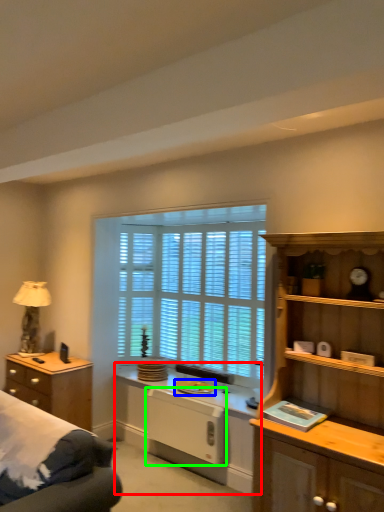
Question: Which is nearer to the computer desk (highlighted by a red box)? appliance (highlighted by a blue box) or appliance (highlighted by a green box).

Choices:
 (A) appliance
 (B) appliance

Answer: (B)